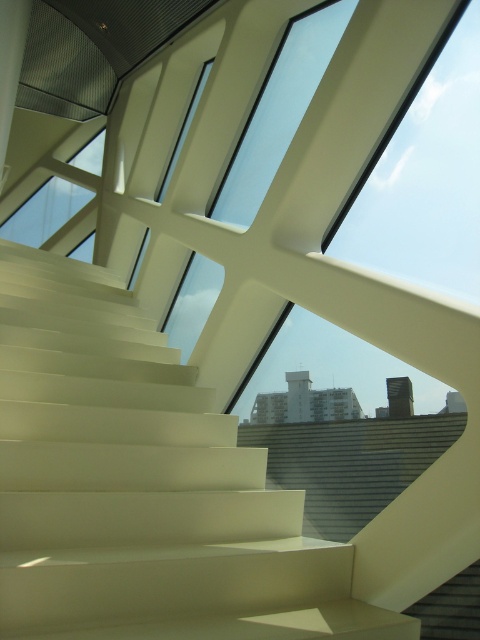
Question: Considering the real-world distances, which object is closest to the transparent glass window at upper left?

Choices:
 (A) white glossy stairs at center
 (B) transparent glass window at upper center

Answer: (B)

Question: Can you confirm if transparent glass window at upper center is smaller than transparent glass window at upper left?

Choices:
 (A) no
 (B) yes

Answer: (A)

Question: Among these points, which one is nearest to the camera?

Choices:
 (A) (76, 164)
 (B) (282, 49)

Answer: (B)

Question: Is white glossy stairs at center wider than transparent glass window at upper center?

Choices:
 (A) yes
 (B) no

Answer: (A)

Question: Is white glossy stairs at center below transparent glass window at upper left?

Choices:
 (A) no
 (B) yes

Answer: (B)

Question: Among these objects, which one is farthest from the camera?

Choices:
 (A) transparent glass window at upper left
 (B) white glossy stairs at center

Answer: (A)